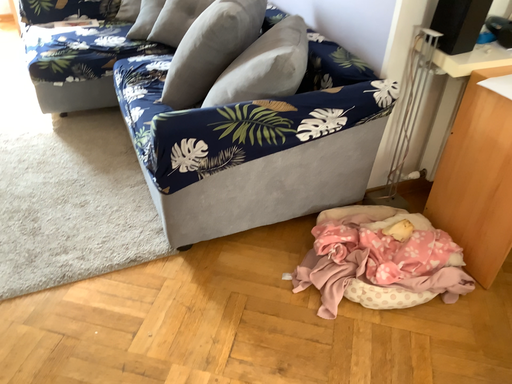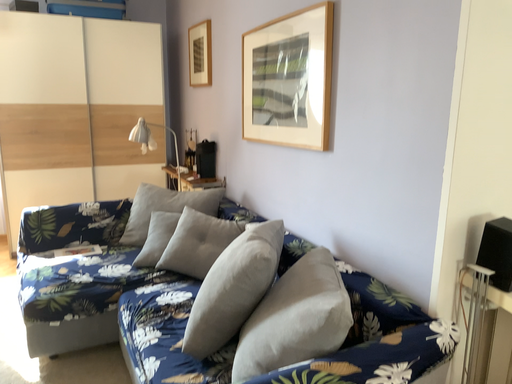
Question: How did the camera likely rotate when shooting the video?

Choices:
 (A) rotated upward
 (B) rotated downward

Answer: (A)